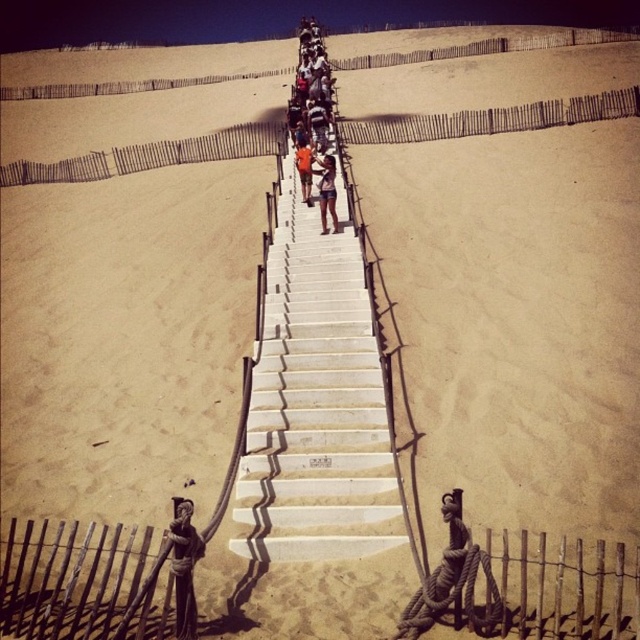
Is white concrete stairs at center to the left of light brown shorts at center from the viewer's perspective?

Indeed, white concrete stairs at center is positioned on the left side of light brown shorts at center.

Does white concrete stairs at center have a lesser height compared to light brown shorts at center?

Incorrect, white concrete stairs at center's height does not fall short of light brown shorts at center's.

The height and width of the screenshot is (640, 640). What do you see at coordinates (316, 404) in the screenshot? I see `white concrete stairs at center` at bounding box center [316, 404].

The image size is (640, 640). What are the coordinates of `white concrete stairs at center` in the screenshot? It's located at (316, 404).

Consider the image. Is light brown shorts at center positioned behind orange fabric shorts at center?

No, it is in front of orange fabric shorts at center.

Between light brown shorts at center and orange fabric shorts at center, which one appears on the left side from the viewer's perspective?

From the viewer's perspective, orange fabric shorts at center appears more on the left side.

Which is in front, point (317, 172) or point (301, 157)?

Point (317, 172) is in front.

Find the location of `light brown shorts at center`. light brown shorts at center is located at coordinates (326, 189).

Who is positioned more to the right, wooden statue at center or light brown shorts at center?

light brown shorts at center

Can you confirm if wooden statue at center is positioned above light brown shorts at center?

No, wooden statue at center is not above light brown shorts at center.

Measure the distance between point (179, 628) and camera.

8.66 meters

The image size is (640, 640). Find the location of `wooden statue at center`. wooden statue at center is located at coordinates (182, 568).